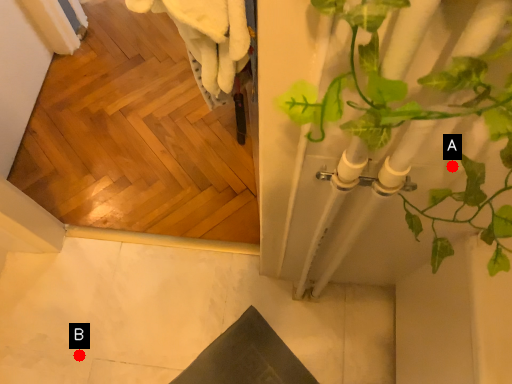
Question: Two points are circled on the image, labeled by A and B beside each circle. Which point is closer to the camera taking this photo?

Choices:
 (A) A is closer
 (B) B is closer

Answer: (A)